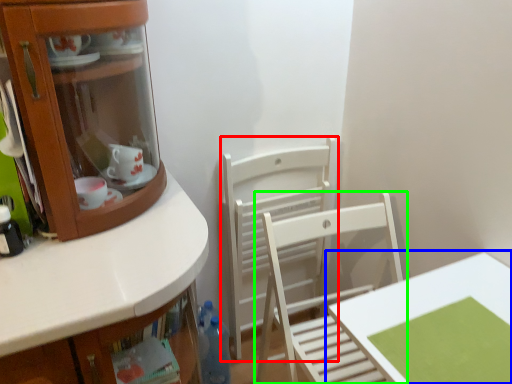
Question: Which is nearer to the chair (highlighted by a red box)? table (highlighted by a blue box) or chair (highlighted by a green box).

Choices:
 (A) table
 (B) chair

Answer: (B)